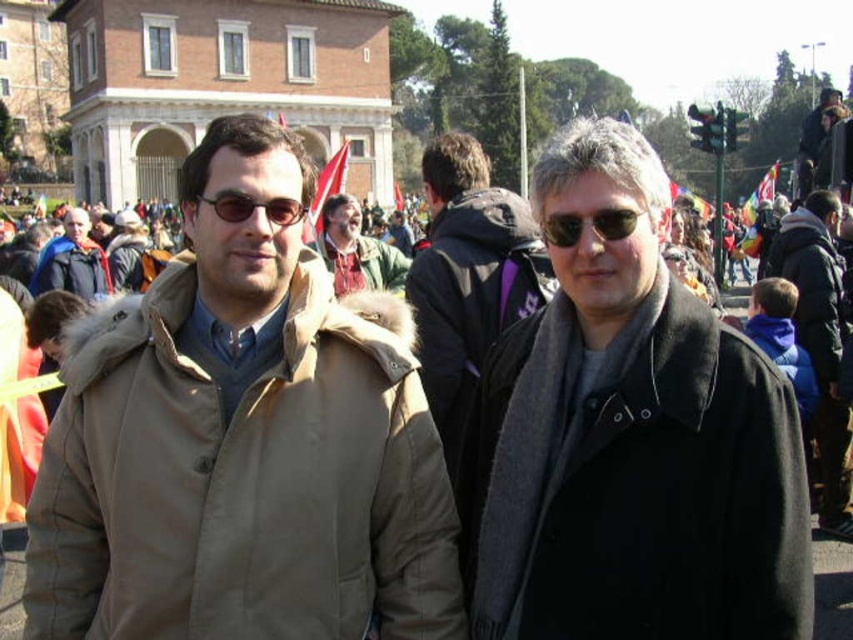
Question: Is dark gray wool scarf at center thinner than dark gray wool jacket at center?

Choices:
 (A) no
 (B) yes

Answer: (A)

Question: Which point is farther from the camera taking this photo?

Choices:
 (A) (602, 228)
 (B) (750, 426)
 (C) (55, 262)
 (D) (296, 200)

Answer: (C)

Question: Which point appears closest to the camera in this image?

Choices:
 (A) (36, 269)
 (B) (242, 204)

Answer: (B)

Question: Estimate the real-world distances between objects in this image. Which object is farther from the tan fabric coat at left?

Choices:
 (A) matte black jacket at left
 (B) blue fleece jacket at right
 (C) dark gray wool scarf at center
 (D) sunglasses at center

Answer: (B)

Question: Is dark gray wool scarf at center behind blue fleece jacket at right?

Choices:
 (A) yes
 (B) no

Answer: (B)

Question: Is dark gray wool scarf at center to the right of sunglasses at center from the viewer's perspective?

Choices:
 (A) no
 (B) yes

Answer: (B)